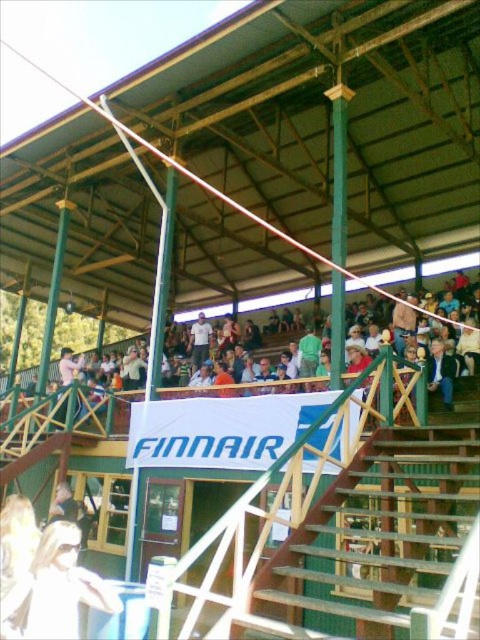
Can you confirm if wooden bleachers at center is positioned below blonde hair at lower left?

No, wooden bleachers at center is not below blonde hair at lower left.

Between wooden bleachers at center and blonde hair at lower left, which one is positioned lower?

blonde hair at lower left is below.

Between point (120, 404) and point (64, 528), which one is positioned in front?

Point (64, 528) is in front.

Where is `wooden bleachers at center`? The image size is (480, 640). wooden bleachers at center is located at coordinates (68, 412).

From the picture: Between wooden bleachers at center and white cotton shirt at upper center, which one appears on the left side from the viewer's perspective?

Positioned to the left is white cotton shirt at upper center.

Measure the distance between wooden bleachers at center and white cotton shirt at upper center.

A distance of 5.43 meters exists between wooden bleachers at center and white cotton shirt at upper center.

Who is more distant from viewer, (x=287, y=381) or (x=205, y=321)?

Positioned behind is point (x=205, y=321).

The width and height of the screenshot is (480, 640). Identify the location of wooden bleachers at center. click(68, 412).

Is blonde hair at lower left positioned in front of white cotton shirt at upper center?

Yes, it is in front of white cotton shirt at upper center.

Measure the distance between point [23,632] and camera.

The distance of point [23,632] from camera is 5.66 meters.

The image size is (480, 640). What do you see at coordinates (55, 589) in the screenshot?
I see `blonde hair at lower left` at bounding box center [55, 589].

This screenshot has width=480, height=640. I want to click on blonde hair at lower left, so click(x=55, y=589).